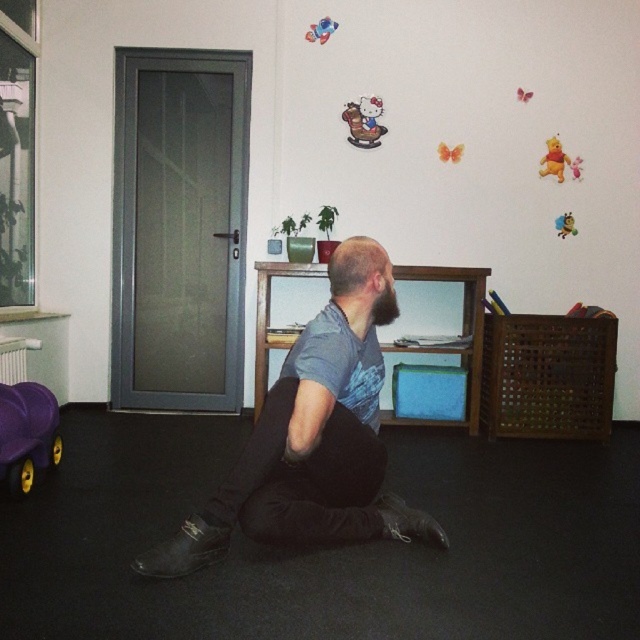
You are standing in the room and want to place a small plant between the dark gray fabric pants at center and the plush yellow bear at upper right. Based on their positions, where should you place the plant?

The dark gray fabric pants at center is positioned on the left side of plush yellow bear at upper right, so you should place the plant between them to the right of the dark gray fabric pants at center and to the left of the plush yellow bear at upper right.

You are standing in the room and want to place a small decoration exactly at the point with coordinates (554,161). Which object from the scene will this point land on?

The point at coordinates (554,161) is located on the velvet winnie the pooh at upper right.